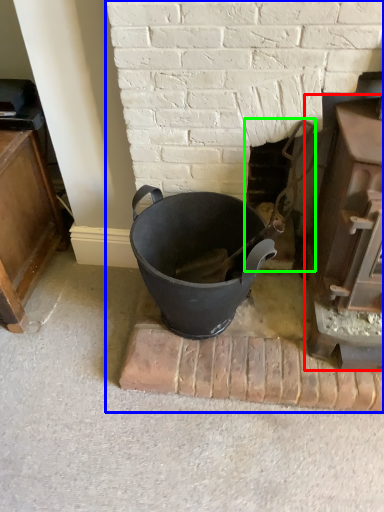
Question: Which is farther away from fireplace (highlighted by a red box)? fireplace (highlighted by a blue box) or fireplace (highlighted by a green box)?

Choices:
 (A) fireplace
 (B) fireplace

Answer: (A)